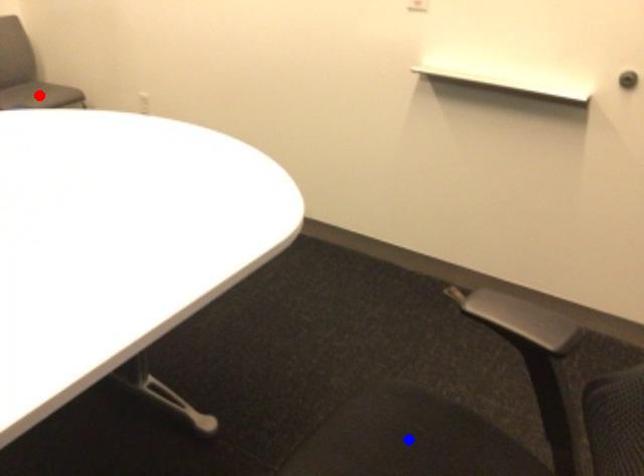
Question: Two points are marked on the image. Which point is closer to the camera?

Choices:
 (A) Blue point is closer.
 (B) Red point is closer.

Answer: (A)